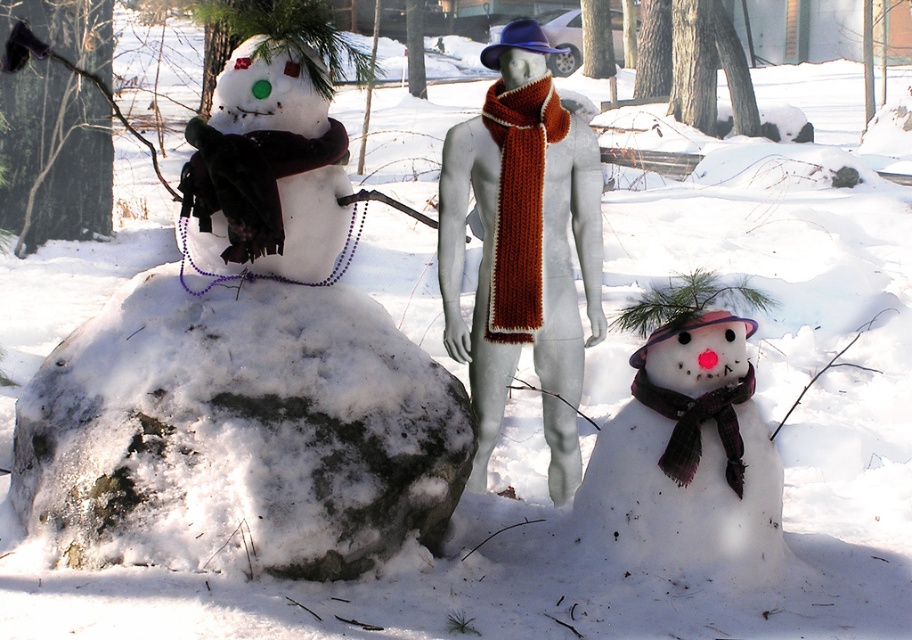
Who is positioned more to the left, matte brown scarf at lower right or knitted orange scarf at center?

knitted orange scarf at center is more to the left.

Can you confirm if matte brown scarf at lower right is taller than knitted orange scarf at center?

No.

Where is `matte brown scarf at lower right`? matte brown scarf at lower right is located at coordinates (686, 442).

Is matte black scarf at left above knitted orange scarf at center?

Indeed, matte black scarf at left is positioned over knitted orange scarf at center.

Between point (218, 209) and point (504, 124), which one is positioned behind?

Point (504, 124)

This screenshot has height=640, width=912. In order to click on matte black scarf at left in this screenshot , I will do `click(268, 166)`.

Does white fluffy snowman at left appear over knitted wool scarf at center?

No, white fluffy snowman at left is not above knitted wool scarf at center.

At what (x,y) coordinates should I click in order to perform the action: click on white fluffy snowman at left. Please return your answer as a coordinate pair (x, y). This screenshot has height=640, width=912. Looking at the image, I should click on [246, 392].